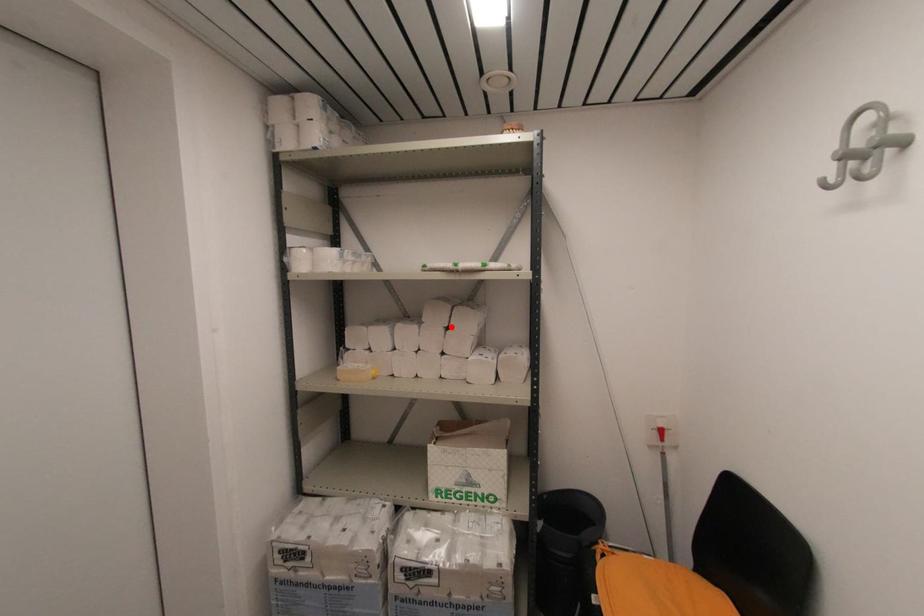
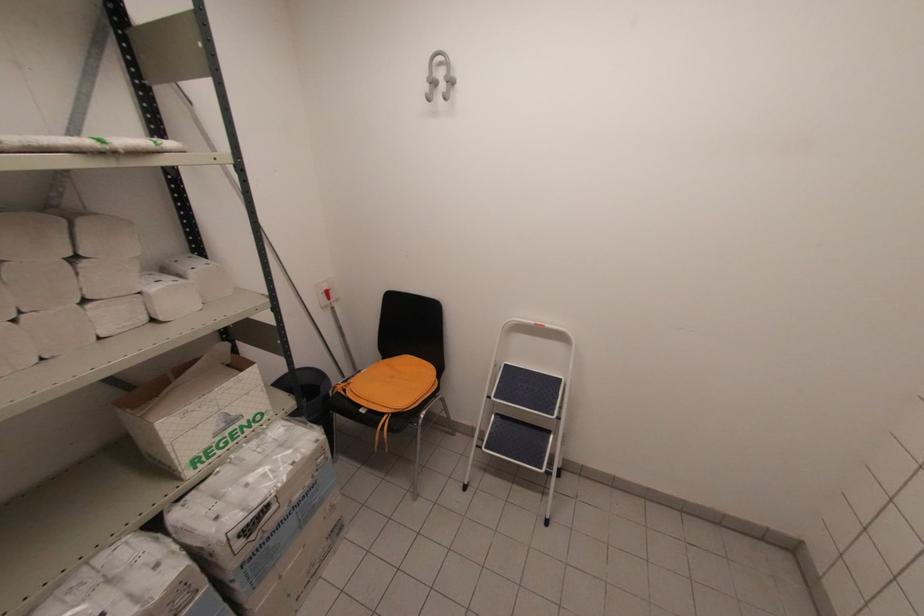
In the second image, find the point that corresponds to the highlighted location in the first image.

(81, 254)